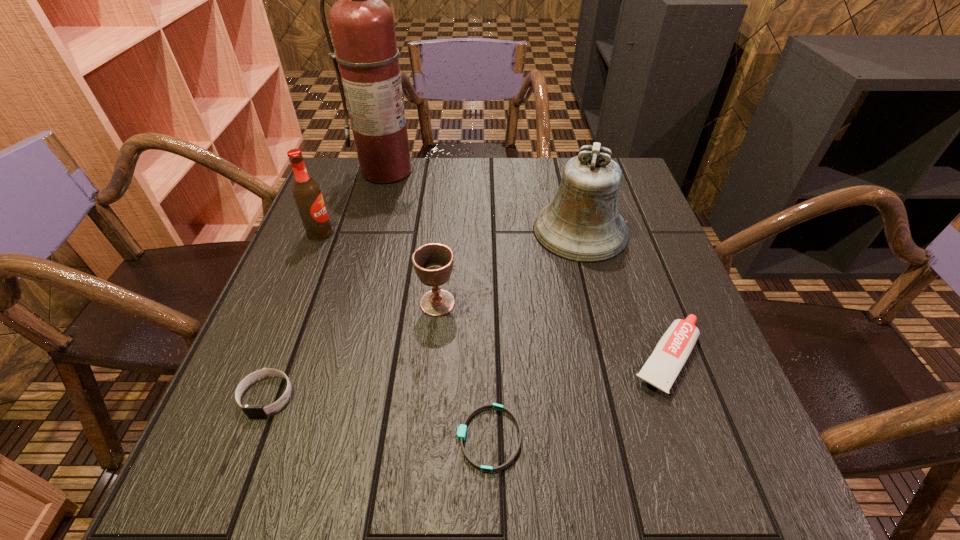
I want to click on the shorter wristband, so click(462, 429).

Locate an element on the screen. The image size is (960, 540). free space located on the front-facing side of the farthest object is located at coordinates (357, 285).

Find the location of a particular element. The image size is (960, 540). vacant position located 0.100m on the back of the bell is located at coordinates (568, 182).

You are a GUI agent. You are given a task and a screenshot of the screen. Output one action in this format:
    pyautogui.click(x=<x>, y=<y>)
    Task: Click on the vacant area situated on the right of the beer bottle
    Image resolution: width=960 pixels, height=540 pixels.
    Given the screenshot: What is the action you would take?
    pyautogui.click(x=387, y=233)

You are a GUI agent. You are given a task and a screenshot of the screen. Output one action in this format:
    pyautogui.click(x=<x>, y=<y>)
    Task: Click on the free point located 0.160m on the right of the chalice
    The image size is (960, 540).
    Given the screenshot: What is the action you would take?
    pyautogui.click(x=534, y=303)

Locate an element on the screen. The width and height of the screenshot is (960, 540). vacant space located on the front of the fifth tallest object is located at coordinates (699, 446).

Locate an element on the screen. blank space located 0.110m on the outer surface of the second shortest object is located at coordinates (232, 487).

Locate an element on the screen. vacant space located on the buckle of the shortest object is located at coordinates (245, 438).

You are a GUI agent. You are given a task and a screenshot of the screen. Output one action in this format:
    pyautogui.click(x=<x>, y=<y>)
    Task: Click on the free space located 0.070m on the buckle of the shortest object
    Image resolution: width=960 pixels, height=540 pixels.
    Given the screenshot: What is the action you would take?
    pyautogui.click(x=413, y=438)

Image resolution: width=960 pixels, height=540 pixels. I want to click on vacant space located on the buckle of the shortest object, so 239,438.